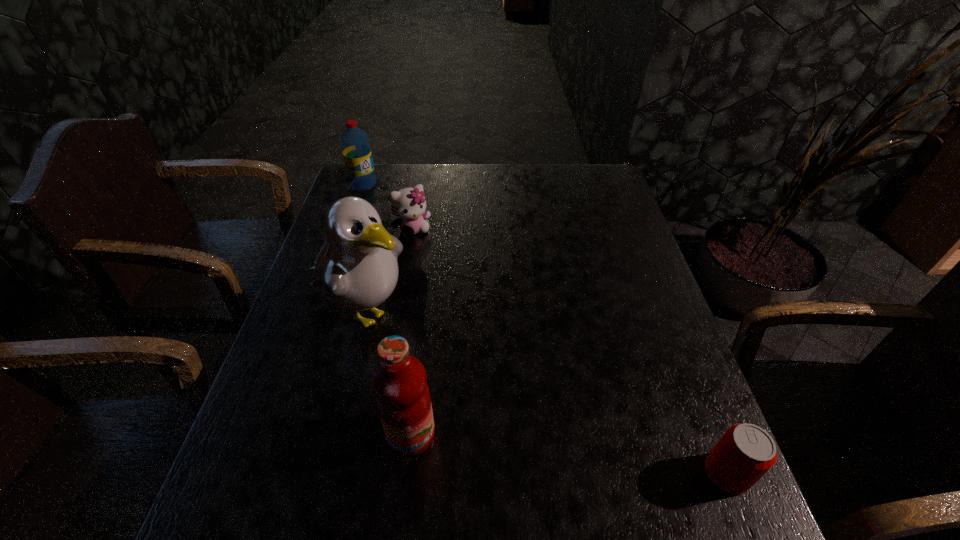
In order to click on free spot located 0.250m on the beak of the gull in this screenshot , I will do `click(479, 392)`.

Where is `vacant point located 0.120m on the beak of the gull`? vacant point located 0.120m on the beak of the gull is located at coordinates (435, 360).

Where is `free spot located 0.210m on the beak of the gull`? Image resolution: width=960 pixels, height=540 pixels. free spot located 0.210m on the beak of the gull is located at coordinates (465, 382).

Where is `vacant space situated on the front-facing side of the fourth nearest object`? The height and width of the screenshot is (540, 960). vacant space situated on the front-facing side of the fourth nearest object is located at coordinates click(484, 329).

You are a GUI agent. You are given a task and a screenshot of the screen. Output one action in this format:
    pyautogui.click(x=<x>, y=<y>)
    Task: Click on the vacant region located on the front-facing side of the fourth nearest object
    This screenshot has height=540, width=960.
    Given the screenshot: What is the action you would take?
    pyautogui.click(x=470, y=309)

Where is `vacant position located 0.290m on the front-facing side of the fourth nearest object`? The width and height of the screenshot is (960, 540). vacant position located 0.290m on the front-facing side of the fourth nearest object is located at coordinates (465, 302).

The image size is (960, 540). I want to click on vacant space located 0.310m on the front label of the water bottle, so click(x=408, y=240).

I want to click on vacant region located 0.160m on the front label of the water bottle, so click(x=388, y=214).

The width and height of the screenshot is (960, 540). What are the coordinates of `vacant space located 0.350m on the front label of the water bottle` in the screenshot? It's located at (415, 247).

At what (x,y) coordinates should I click in order to perform the action: click on object located in the far edge section of the desktop. Please return your answer as a coordinate pair (x, y). The image size is (960, 540). Looking at the image, I should click on (355, 144).